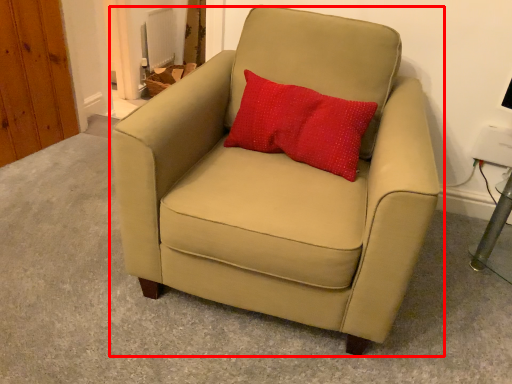
Question: From the image's perspective, considering the relative positions of chair (annotated by the red box) and pillow in the image provided, where is chair (annotated by the red box) located with respect to the staircase?

Choices:
 (A) above
 (B) below

Answer: (B)